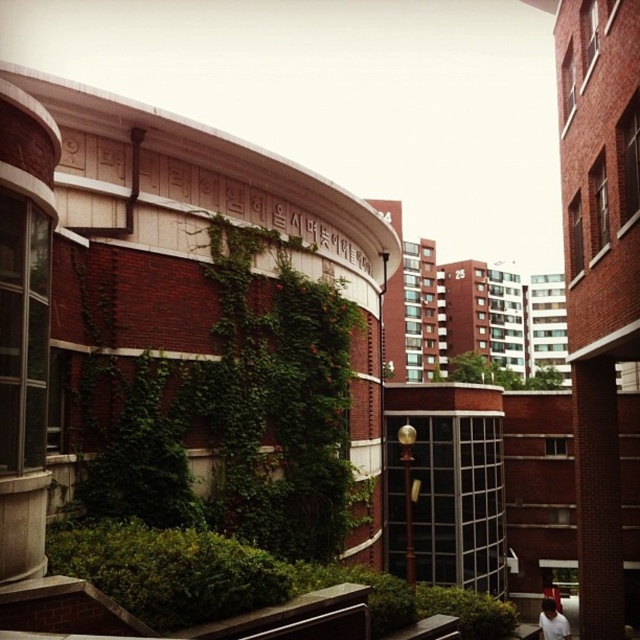
Question: Is green leafy ivy at center above white cotton shirt at lower right?

Choices:
 (A) no
 (B) yes

Answer: (B)

Question: Can you confirm if green leafy ivy at center is thinner than white cotton shirt at lower right?

Choices:
 (A) no
 (B) yes

Answer: (A)

Question: Can you confirm if green leafy ivy at center is positioned to the right of white cotton shirt at lower right?

Choices:
 (A) no
 (B) yes

Answer: (B)

Question: Among these points, which one is farthest from the camera?

Choices:
 (A) (484, 371)
 (B) (544, 632)

Answer: (A)